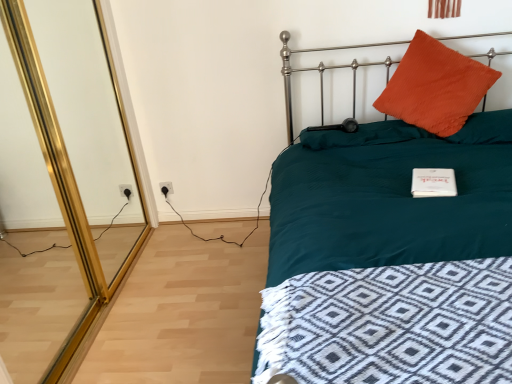
Question: Is the position of orange corduroy pillow at upper right, marked as the 3th pillow in a left-to-right arrangement, less distant than that of teal fabric bed at upper right?

Choices:
 (A) no
 (B) yes

Answer: (A)

Question: Is orange corduroy pillow at upper right, marked as the 3th pillow in a left-to-right arrangement, further to camera compared to teal fabric bed at upper right?

Choices:
 (A) yes
 (B) no

Answer: (A)

Question: Can you confirm if orange corduroy pillow at upper right, the 1th pillow from the right, is bigger than teal fabric bed at upper right?

Choices:
 (A) no
 (B) yes

Answer: (A)

Question: Considering the relative sizes of orange corduroy pillow at upper right, marked as the 3th pillow in a left-to-right arrangement, and teal fabric bed at upper right in the image provided, is orange corduroy pillow at upper right, marked as the 3th pillow in a left-to-right arrangement, smaller than teal fabric bed at upper right?

Choices:
 (A) no
 (B) yes

Answer: (B)

Question: Can you confirm if orange corduroy pillow at upper right, the 1th pillow from the right, is shorter than teal fabric bed at upper right?

Choices:
 (A) yes
 (B) no

Answer: (A)

Question: In terms of width, does white plastic electric outlet at lower left look wider or thinner when compared to orange corduroy pillow at upper right, marked as the 3th pillow in a left-to-right arrangement?

Choices:
 (A) wide
 (B) thin

Answer: (B)

Question: In the image, is white plastic electric outlet at lower left positioned in front of or behind orange corduroy pillow at upper right, the 1th pillow from the right?

Choices:
 (A) front
 (B) behind

Answer: (B)

Question: From a real-world perspective, relative to orange corduroy pillow at upper right, the 1th pillow from the right, is white plastic electric outlet at lower left vertically above or below?

Choices:
 (A) below
 (B) above

Answer: (A)

Question: Is point (170, 190) closer or farther from the camera than point (461, 127)?

Choices:
 (A) farther
 (B) closer

Answer: (A)

Question: In terms of width, does orange fuzzy pillow at upper right, which is the 1th pillow from left to right, look wider or thinner when compared to orange corduroy pillow at upper right, arranged as the second pillow when viewed from the left?

Choices:
 (A) wide
 (B) thin

Answer: (B)

Question: From the image's perspective, is orange fuzzy pillow at upper right, acting as the 3th pillow starting from the right, located above or below orange corduroy pillow at upper right, arranged as the second pillow when viewed from the left?

Choices:
 (A) below
 (B) above

Answer: (A)

Question: Considering the relative positions of orange fuzzy pillow at upper right, which is the 1th pillow from left to right, and orange corduroy pillow at upper right, arranged as the second pillow when viewed from the left, in the image provided, is orange fuzzy pillow at upper right, which is the 1th pillow from left to right, to the left or to the right of orange corduroy pillow at upper right, arranged as the second pillow when viewed from the left,?

Choices:
 (A) right
 (B) left

Answer: (B)

Question: Is orange fuzzy pillow at upper right, acting as the 3th pillow starting from the right, taller or shorter than orange corduroy pillow at upper right, arranged as the second pillow when viewed from the right?

Choices:
 (A) short
 (B) tall

Answer: (A)

Question: Does point click(346, 142) appear closer or farther from the camera than point click(164, 182)?

Choices:
 (A) closer
 (B) farther

Answer: (A)

Question: Relative to white plastic electric outlet at lower left, is orange fuzzy pillow at upper right, which is the 1th pillow from left to right, in front or behind?

Choices:
 (A) front
 (B) behind

Answer: (A)